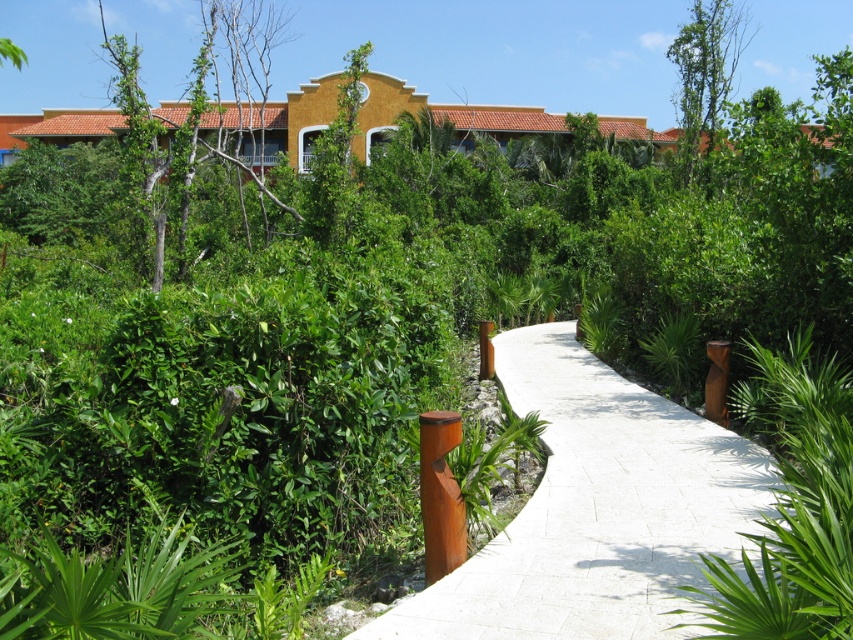
Question: Does green leafy tree at upper left appear under green leafy tree at upper right?

Choices:
 (A) yes
 (B) no

Answer: (A)

Question: Which point is farther to the camera?

Choices:
 (A) (213, 144)
 (B) (701, 68)
 (C) (131, 92)
 (D) (635, 554)

Answer: (B)

Question: Where is white concrete pavement at center located in relation to green leafy tree at upper left in the image?

Choices:
 (A) above
 (B) below

Answer: (B)

Question: Which of these objects is positioned farthest from the white concrete pavement at center?

Choices:
 (A) green leafy tree at upper right
 (B) green leafy tree at upper left

Answer: (A)

Question: Does white concrete pavement at center have a larger size compared to green leafy tree at upper right?

Choices:
 (A) yes
 (B) no

Answer: (B)

Question: Which point is closer to the camera?

Choices:
 (A) white concrete pavement at center
 (B) bare wood tree at upper center
 (C) green leafy tree at upper right

Answer: (A)